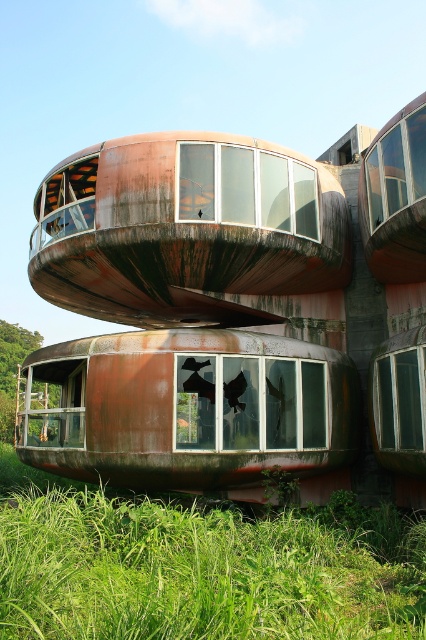
Question: Does green grassy at lower left lie behind rusty metal train car at lower center?

Choices:
 (A) yes
 (B) no

Answer: (B)

Question: Which of the following is the closest to the observer?

Choices:
 (A) green grassy at lower left
 (B) rusty metal train car at lower center

Answer: (A)

Question: Does green grassy at lower left have a lesser width compared to rusty metal train car at lower center?

Choices:
 (A) no
 (B) yes

Answer: (A)

Question: Can you confirm if green grassy at lower left is positioned to the right of rusty metal train car at lower center?

Choices:
 (A) no
 (B) yes

Answer: (B)

Question: Among these objects, which one is farthest from the camera?

Choices:
 (A) rusty metal train car at lower center
 (B) green grassy at lower left

Answer: (A)